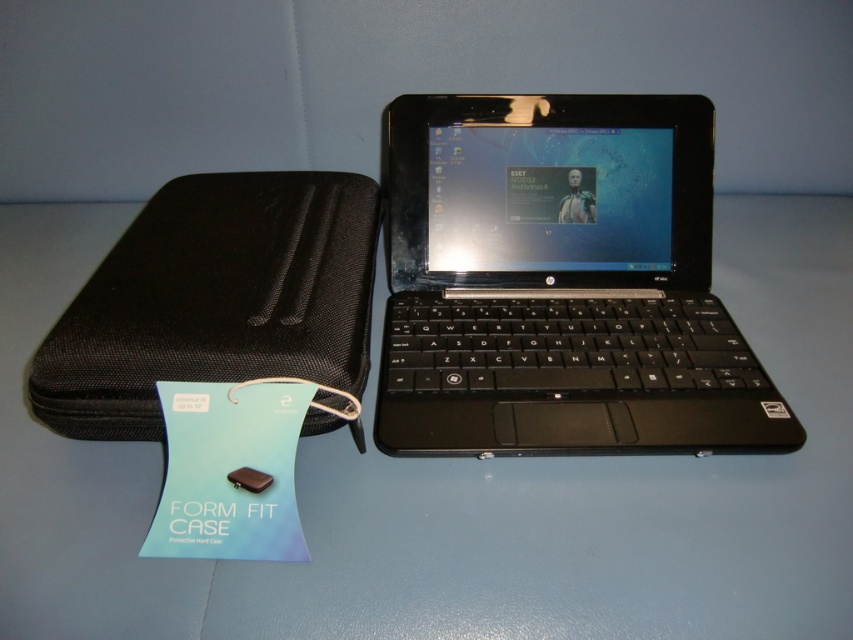
Question: Does blue matte table at center have a larger size compared to black plastic laptop at center?

Choices:
 (A) no
 (B) yes

Answer: (B)

Question: Which point is farther from the camera taking this photo?

Choices:
 (A) (462, 209)
 (B) (368, 353)
 (C) (689, 577)

Answer: (A)

Question: Which point appears closest to the camera in this image?

Choices:
 (A) (308, 566)
 (B) (32, 380)
 (C) (447, 381)

Answer: (A)

Question: Observing the image, what is the correct spatial positioning of blue matte table at center in reference to black fabric case at left?

Choices:
 (A) below
 (B) above

Answer: (A)

Question: Is black plastic laptop at center thinner than black fabric case at left?

Choices:
 (A) no
 (B) yes

Answer: (A)

Question: Based on their relative distances, which object is farther from the black fabric case at left?

Choices:
 (A) blue matte table at center
 (B) black plastic laptop at center

Answer: (B)